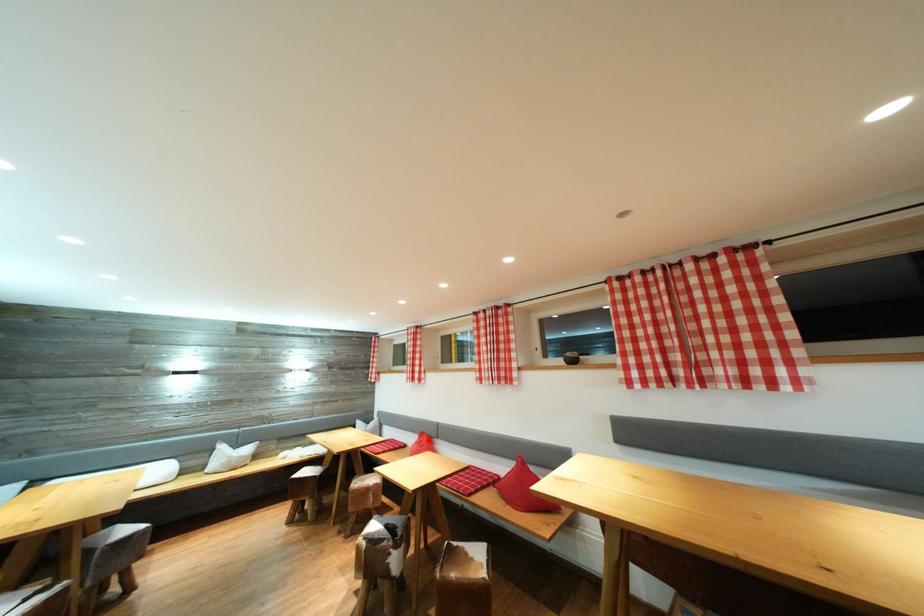
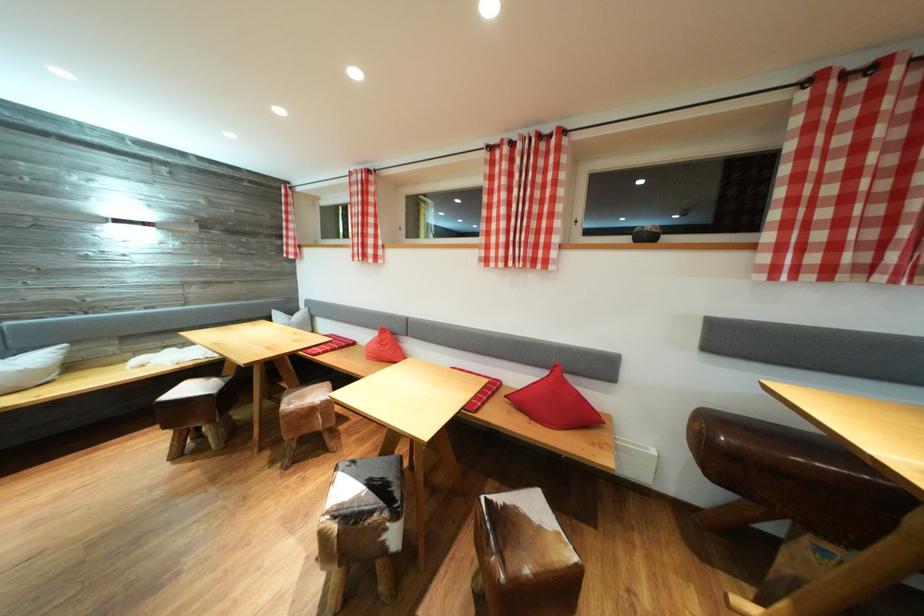
Question: I am providing you with two images of the same scene from different viewpoints. Image1 has a red point marked. In image2, the corresponding 3D location appears at what relative position? Reply with the corresponding letter.

Choices:
 (A) Closer
 (B) Farther

Answer: (A)